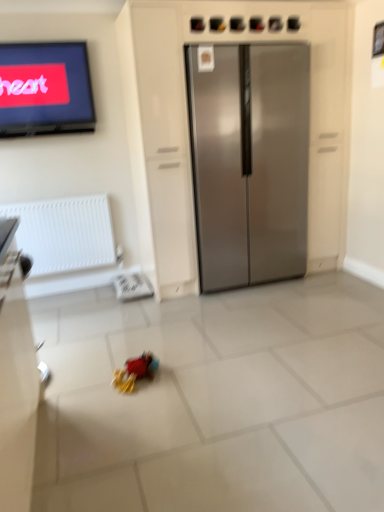
What is the approximate width of rubberized plastic toy at center?

The width of rubberized plastic toy at center is 11.39 inches.

Image resolution: width=384 pixels, height=512 pixels. What do you see at coordinates (65, 233) in the screenshot?
I see `white textured radiator at left` at bounding box center [65, 233].

Find the location of a particular element. The width and height of the screenshot is (384, 512). rubberized plastic toy at center is located at coordinates (134, 371).

From the image's perspective, is white textured radiator at left above stainless steel refrigerator at center?

No, from the image's perspective, white textured radiator at left is not on top of stainless steel refrigerator at center.

Based on the photo, which of these two, white textured radiator at left or stainless steel refrigerator at center, is bigger?

With larger size is stainless steel refrigerator at center.

Which is in front, point (50, 219) or point (296, 262)?

Positioned in front is point (50, 219).

Is white textured radiator at left situated inside stainless steel refrigerator at center or outside?

white textured radiator at left is not inside stainless steel refrigerator at center, it's outside.

Between point (254, 142) and point (156, 367), which one is positioned in front?

Point (156, 367)

From the image's perspective, which one is positioned lower, stainless steel refrigerator at center or rubberized plastic toy at center?

rubberized plastic toy at center.

Are stainless steel refrigerator at center and rubberized plastic toy at center located far from each other?

Yes, stainless steel refrigerator at center is far from rubberized plastic toy at center.

Does stainless steel refrigerator at center lie in front of rubberized plastic toy at center?

No, it is behind rubberized plastic toy at center.

How many degrees apart are the facing directions of white textured radiator at left and rubberized plastic toy at center?

The angle between the facing direction of white textured radiator at left and the facing direction of rubberized plastic toy at center is 90.5 degrees.

Does point (24, 212) lie behind point (133, 385)?

Yes.

Which object is closer to the camera, white textured radiator at left or rubberized plastic toy at center?

rubberized plastic toy at center.

Can you confirm if white textured radiator at left is thinner than rubberized plastic toy at center?

Correct, the width of white textured radiator at left is less than that of rubberized plastic toy at center.

Where is `refrigerator above the white textured radiator at left (from a real-world perspective)`? refrigerator above the white textured radiator at left (from a real-world perspective) is located at coordinates (250, 162).

Is white textured radiator at left inside stainless steel refrigerator at center?

No, white textured radiator at left is not inside stainless steel refrigerator at center.

Is point (245, 254) positioned in front of point (99, 256)?

Yes, it is.

From the image's perspective, who appears lower, stainless steel refrigerator at center or white textured radiator at left?

white textured radiator at left.

Looking at this image, is stainless steel refrigerator at center completely or partially inside rubberized plastic toy at center?

No, stainless steel refrigerator at center is not a part of rubberized plastic toy at center.

Is rubberized plastic toy at center oriented away from stainless steel refrigerator at center?

No, rubberized plastic toy at center is not facing the opposite direction of stainless steel refrigerator at center.

From a real-world perspective, relative to stainless steel refrigerator at center, is rubberized plastic toy at center vertically above or below?

From a real-world perspective, rubberized plastic toy at center is physically below stainless steel refrigerator at center.

Considering the positions of points (142, 375) and (279, 267), is point (142, 375) closer to camera compared to point (279, 267)?

That is True.

Does rubberized plastic toy at center turn towards white textured radiator at left?

No, rubberized plastic toy at center is not turned towards white textured radiator at left.

How different are the orientations of rubberized plastic toy at center and white textured radiator at left in degrees?

rubberized plastic toy at center and white textured radiator at left are facing 90.5 degrees away from each other.

Is the depth of rubberized plastic toy at center greater than that of white textured radiator at left?

No, it is in front of white textured radiator at left.

From the image's perspective, is rubberized plastic toy at center on top of white textured radiator at left?

Incorrect, from the image's perspective, rubberized plastic toy at center is lower than white textured radiator at left.

Where is `refrigerator on the right of the white textured radiator at left`? refrigerator on the right of the white textured radiator at left is located at coordinates (250, 162).

You are a GUI agent. You are given a task and a screenshot of the screen. Output one action in this format:
    pyautogui.click(x=<x>, y=<y>)
    Task: Click on the miniature in front of the stainless steel refrigerator at center
    
    Given the screenshot: What is the action you would take?
    pyautogui.click(x=134, y=371)

From the image, which object appears to be nearer to rubberized plastic toy at center, white textured radiator at left or stainless steel refrigerator at center?

Among the two, white textured radiator at left is located nearer to rubberized plastic toy at center.

Looking at the image, which one is located further to rubberized plastic toy at center, stainless steel refrigerator at center or white textured radiator at left?

The object further to rubberized plastic toy at center is stainless steel refrigerator at center.

When comparing their distances from white textured radiator at left, does rubberized plastic toy at center or stainless steel refrigerator at center seem further?

The object further to white textured radiator at left is rubberized plastic toy at center.

From the image, which object appears to be nearer to stainless steel refrigerator at center, rubberized plastic toy at center or white textured radiator at left?

white textured radiator at left is closer to stainless steel refrigerator at center.

From the image, which object appears to be nearer to white textured radiator at left, stainless steel refrigerator at center or rubberized plastic toy at center?

stainless steel refrigerator at center is positioned closer to the anchor white textured radiator at left.

Which object lies nearer to the anchor point stainless steel refrigerator at center, white textured radiator at left or rubberized plastic toy at center?

The object closer to stainless steel refrigerator at center is white textured radiator at left.

What are the coordinates of `miniature located between white textured radiator at left and stainless steel refrigerator at center in the left-right direction` in the screenshot? It's located at (134, 371).